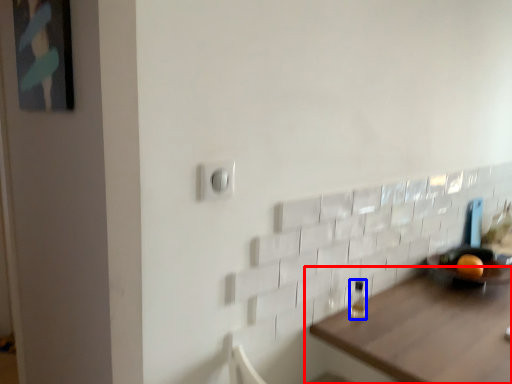
Question: Which point is closer to the camera, table (highlighted by a red box) or bottle (highlighted by a blue box)?

Choices:
 (A) table
 (B) bottle

Answer: (A)